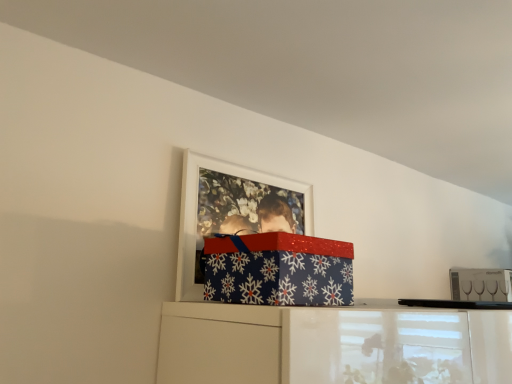
Question: Considering the relative sizes of clear glass wine glasses at upper right and white matte picture frame at upper center in the image provided, is clear glass wine glasses at upper right wider than white matte picture frame at upper center?

Choices:
 (A) no
 (B) yes

Answer: (B)

Question: From the image's perspective, is clear glass wine glasses at upper right above white matte picture frame at upper center?

Choices:
 (A) yes
 (B) no

Answer: (B)

Question: Considering the relative positions of clear glass wine glasses at upper right and white matte picture frame at upper center in the image provided, is clear glass wine glasses at upper right to the left of white matte picture frame at upper center from the viewer's perspective?

Choices:
 (A) yes
 (B) no

Answer: (B)

Question: Considering the relative sizes of clear glass wine glasses at upper right and white matte picture frame at upper center in the image provided, is clear glass wine glasses at upper right smaller than white matte picture frame at upper center?

Choices:
 (A) no
 (B) yes

Answer: (A)

Question: Is clear glass wine glasses at upper right taller than white matte picture frame at upper center?

Choices:
 (A) yes
 (B) no

Answer: (B)

Question: From a real-world perspective, is clear glass wine glasses at upper right over white matte picture frame at upper center?

Choices:
 (A) yes
 (B) no

Answer: (B)

Question: Is clear glass wine glasses at upper right inside white matte picture frame at upper center?

Choices:
 (A) no
 (B) yes

Answer: (A)

Question: Is white matte picture frame at upper center turned away from clear glass wine glasses at upper right?

Choices:
 (A) yes
 (B) no

Answer: (B)

Question: Considering the relative positions of white matte picture frame at upper center and clear glass wine glasses at upper right in the image provided, is white matte picture frame at upper center to the left of clear glass wine glasses at upper right from the viewer's perspective?

Choices:
 (A) yes
 (B) no

Answer: (A)

Question: Is white matte picture frame at upper center bigger than clear glass wine glasses at upper right?

Choices:
 (A) no
 (B) yes

Answer: (A)

Question: Does white matte picture frame at upper center come behind clear glass wine glasses at upper right?

Choices:
 (A) yes
 (B) no

Answer: (B)

Question: Does white matte picture frame at upper center have a lesser width compared to clear glass wine glasses at upper right?

Choices:
 (A) no
 (B) yes

Answer: (B)

Question: Is blue paper with snowflakes at upper center wider than clear glass wine glasses at upper right?

Choices:
 (A) no
 (B) yes

Answer: (B)